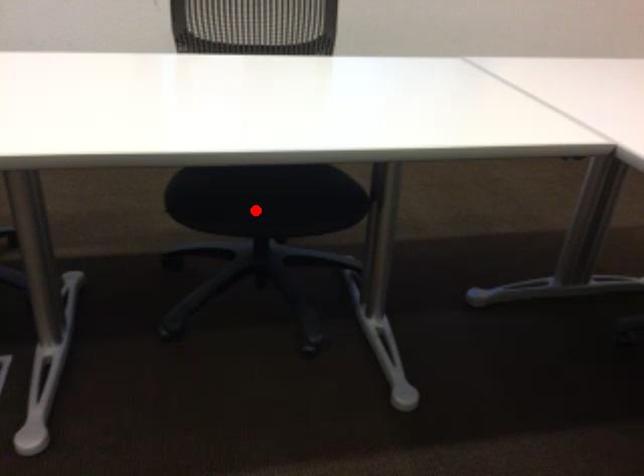
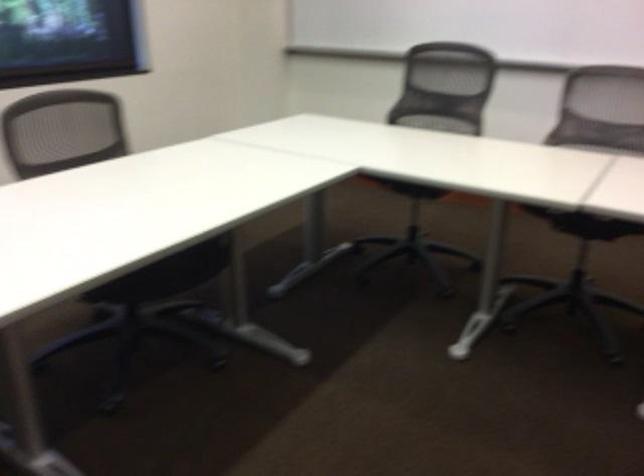
In the second image, find the point that corresponds to the highlighted location in the first image.

(166, 275)